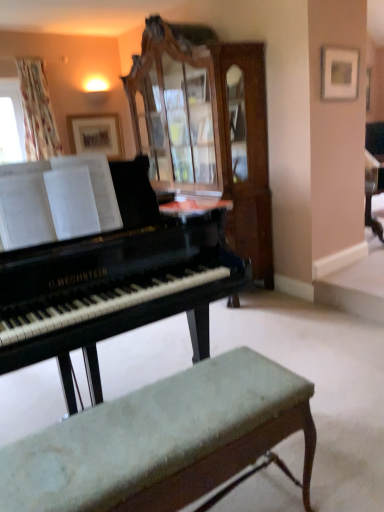
Question: Should I look upward or downward to see orange glossy table at center?

Choices:
 (A) up
 (B) down

Answer: (A)

Question: Is velvet green bench at lower center outside of orange glossy table at center?

Choices:
 (A) yes
 (B) no

Answer: (A)

Question: Is the depth of velvet green bench at lower center less than that of orange glossy table at center?

Choices:
 (A) no
 (B) yes

Answer: (B)

Question: Is velvet green bench at lower center taller than orange glossy table at center?

Choices:
 (A) no
 (B) yes

Answer: (B)

Question: Is velvet green bench at lower center turned away from orange glossy table at center?

Choices:
 (A) yes
 (B) no

Answer: (B)

Question: Is velvet green bench at lower center wider than orange glossy table at center?

Choices:
 (A) yes
 (B) no

Answer: (A)

Question: Is velvet green bench at lower center facing towards orange glossy table at center?

Choices:
 (A) no
 (B) yes

Answer: (A)

Question: Is velvet green bench at lower center inside orange glossy table at center?

Choices:
 (A) yes
 (B) no

Answer: (B)

Question: Is orange glossy table at center wider than velvet green bench at lower center?

Choices:
 (A) yes
 (B) no

Answer: (B)

Question: Considering the relative positions of orange glossy table at center and velvet green bench at lower center in the image provided, is orange glossy table at center behind velvet green bench at lower center?

Choices:
 (A) no
 (B) yes

Answer: (B)

Question: Is orange glossy table at center oriented away from velvet green bench at lower center?

Choices:
 (A) yes
 (B) no

Answer: (B)

Question: Does orange glossy table at center have a larger size compared to velvet green bench at lower center?

Choices:
 (A) yes
 (B) no

Answer: (B)

Question: Is there a large distance between orange glossy table at center and velvet green bench at lower center?

Choices:
 (A) yes
 (B) no

Answer: (B)

Question: Is black polished piano at center touching orange glossy table at center?

Choices:
 (A) yes
 (B) no

Answer: (B)